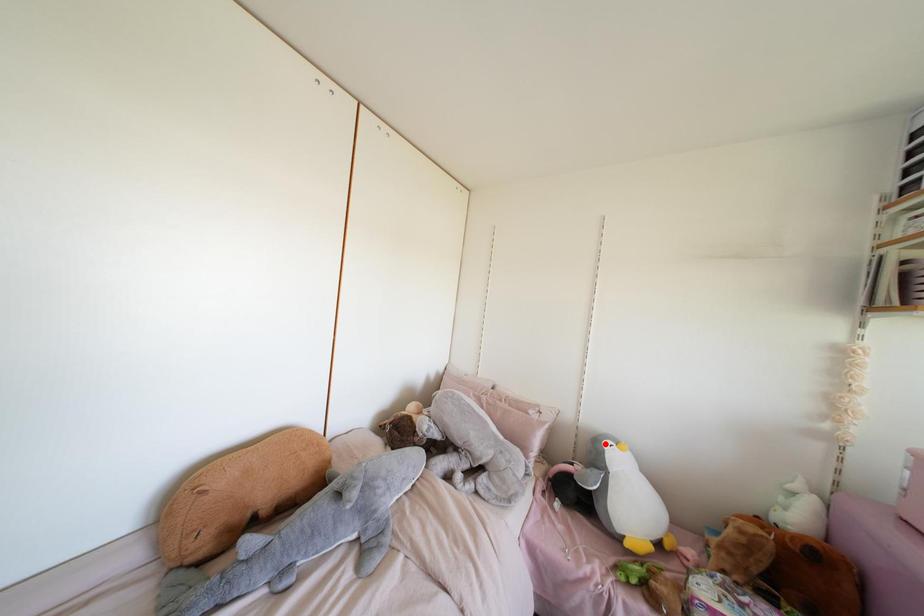
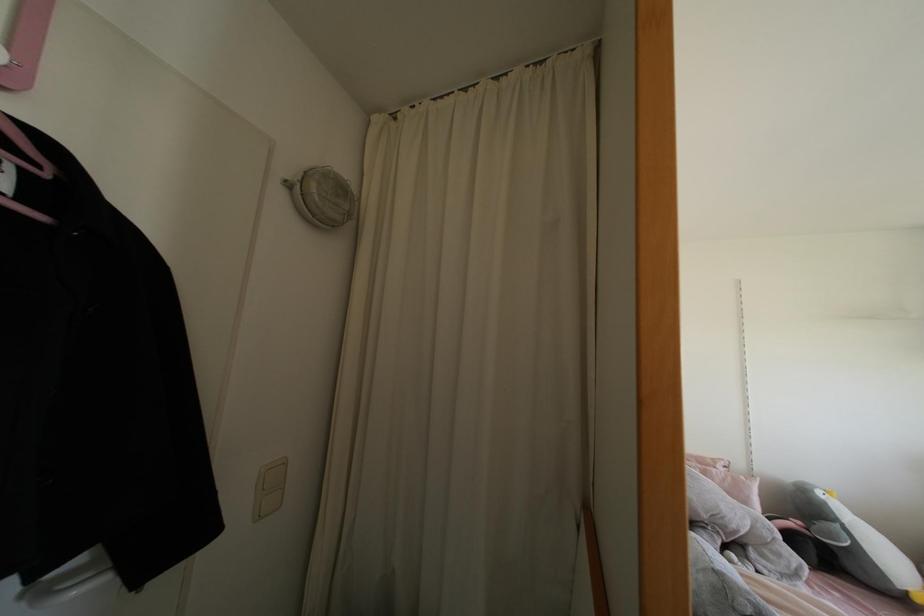
Find the pixel in the second image that matches the highlighted location in the first image.

(819, 493)